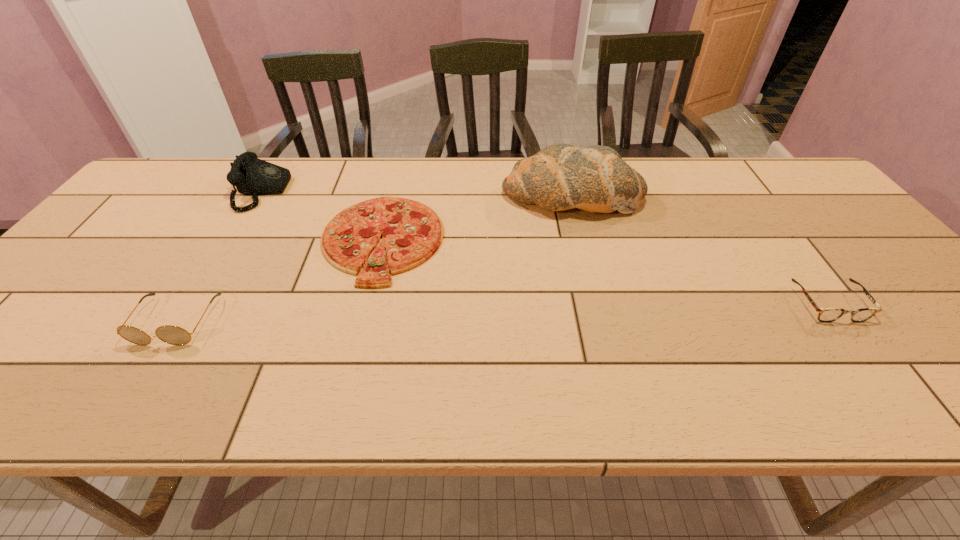
I want to click on vacant position at the right edge of the desktop, so click(926, 308).

Where is `free space between the second tallest object and the bread`? free space between the second tallest object and the bread is located at coordinates (417, 194).

The image size is (960, 540). In order to click on vacant region between the fourth object from left to right and the telephone in this screenshot , I will do `click(417, 194)`.

The image size is (960, 540). I want to click on free area in between the sunglasses and the spectacles, so click(502, 313).

You are a GUI agent. You are given a task and a screenshot of the screen. Output one action in this format:
    pyautogui.click(x=<x>, y=<y>)
    Task: Click on the empty space that is in between the rightmost object and the tallest object
    
    Given the screenshot: What is the action you would take?
    pyautogui.click(x=700, y=249)

You are a GUI agent. You are given a task and a screenshot of the screen. Output one action in this format:
    pyautogui.click(x=<x>, y=<y>)
    Task: Click on the free point between the fourth object from left to right and the second tallest object
    
    Given the screenshot: What is the action you would take?
    pyautogui.click(x=417, y=194)

Locate an element on the screen. vacant point located between the pizza and the fourth shortest object is located at coordinates (x=322, y=215).

Locate an element on the screen. free space between the telephone and the third tallest object is located at coordinates (219, 256).

In order to click on object that can be found as the third closest to the bread in this screenshot , I will do `click(252, 176)`.

Locate which object is the closest to the rightmost object. Please provide its 2D coordinates. Your answer should be formatted as a tuple, i.e. [(x, y)], where the tuple contains the x and y coordinates of a point satisfying the conditions above.

[(559, 177)]